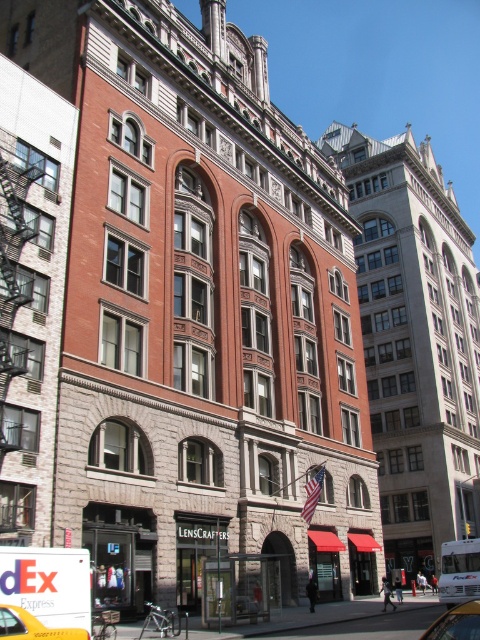
Who is more distant from viewer, (3, 608) or (468, 637)?

The point (3, 608) is more distant.

Can you confirm if yellow rubber taxi at lower left is taller than metallic silver car at lower right?

Incorrect, yellow rubber taxi at lower left's height is not larger of metallic silver car at lower right's.

Does point (83, 628) come behind point (469, 624)?

Yes.

This screenshot has width=480, height=640. I want to click on yellow rubber taxi at lower left, so click(x=33, y=627).